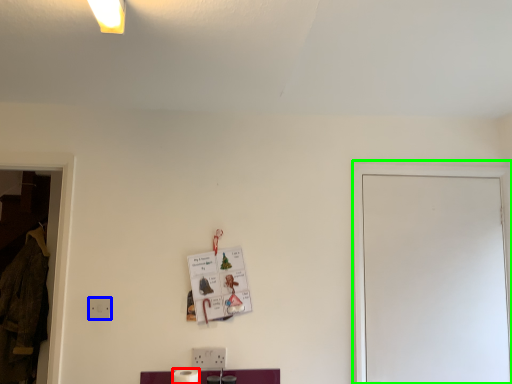
Question: Based on their relative distances, which object is nearer to toilet paper (highlighted by a red box)? Choose from electric outlet (highlighted by a blue box) and glass door (highlighted by a green box).

Choices:
 (A) electric outlet
 (B) glass door

Answer: (A)